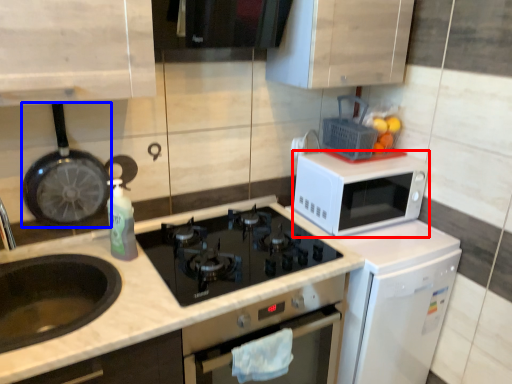
Question: Which of the following is the closest to the observer, microwave oven (highlighted by a red box) or frying pan (highlighted by a blue box)?

Choices:
 (A) microwave oven
 (B) frying pan

Answer: (B)